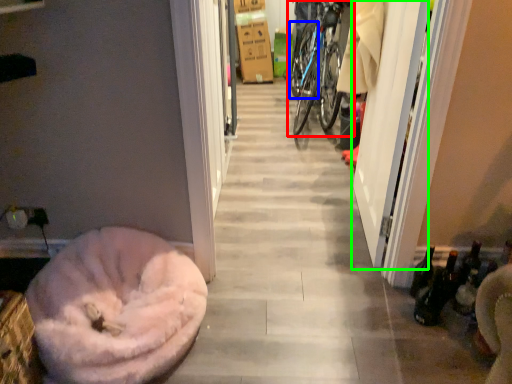
Question: Which object is the farthest from bicycle (highlighted by a red box)? Choose among these: tire (highlighted by a blue box) or screen door (highlighted by a green box).

Choices:
 (A) tire
 (B) screen door

Answer: (B)